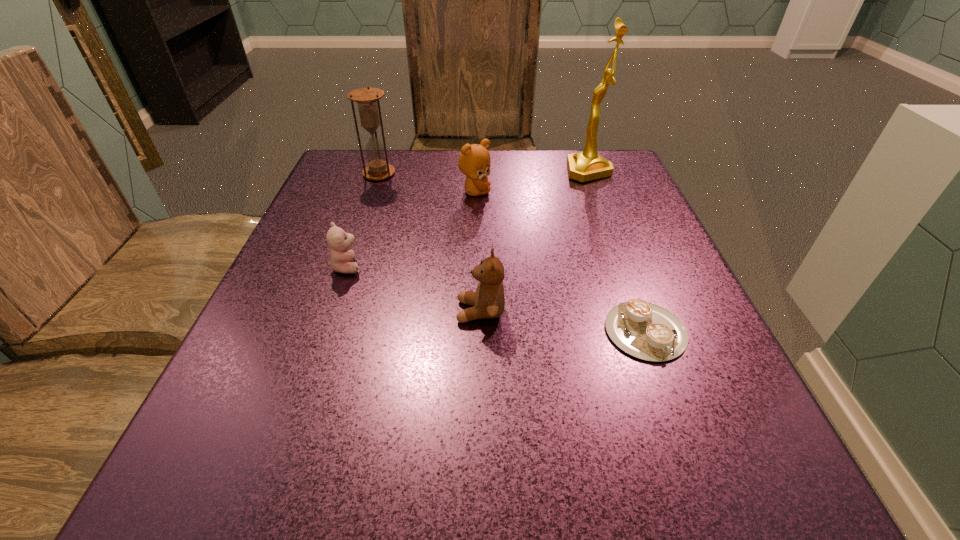
Image resolution: width=960 pixels, height=540 pixels. I want to click on hourglass situated at the left edge, so click(x=367, y=99).

Locate an element on the screen. The height and width of the screenshot is (540, 960). teddy bear that is positioned at the left edge is located at coordinates (341, 257).

Identify the location of award that is at the right edge. The height and width of the screenshot is (540, 960). (588, 165).

Find the location of a particular element. The image size is (960, 540). cappuccino that is at the right edge is located at coordinates (647, 331).

You are a GUI agent. You are given a task and a screenshot of the screen. Output one action in this format:
    pyautogui.click(x=<x>, y=<y>)
    Task: Click on the object that is at the far left corner
    This screenshot has height=540, width=960.
    Given the screenshot: What is the action you would take?
    pyautogui.click(x=367, y=99)

This screenshot has height=540, width=960. What are the coordinates of `object located in the far right corner section of the desktop` in the screenshot? It's located at (588, 165).

You are a GUI agent. You are given a task and a screenshot of the screen. Output one action in this format:
    pyautogui.click(x=<x>, y=<y>)
    Task: Click on the vacant area at the left edge
    
    Given the screenshot: What is the action you would take?
    pyautogui.click(x=306, y=253)

Locate an element on the screen. The height and width of the screenshot is (540, 960). free space at the right edge is located at coordinates (662, 288).

Identify the location of blank space at the far left corner of the desktop. The width and height of the screenshot is (960, 540). (395, 160).

In the image, there is a desktop. Where is `blank space at the near left corner`? blank space at the near left corner is located at coordinates tap(181, 495).